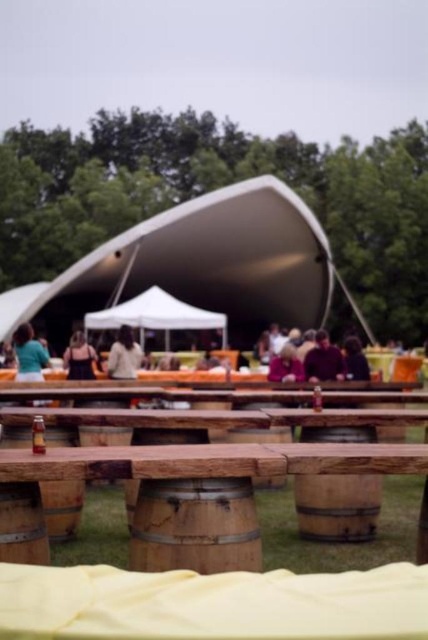
You are setting up a picnic area and need to place both the wooden barrel at center and the rustic wood barrel at lower center. According to the scene, which barrel should you place first to ensure proper positioning?

The wooden barrel at center is positioned over rustic wood barrel at lower center, so you should place the rustic wood barrel at lower center first before placing the wooden barrel at center on top of it.

What is the 2D coordinate of the rustic wood table at center?

The rustic wood table at center is located at the 2D coordinate point of (x=211, y=460).